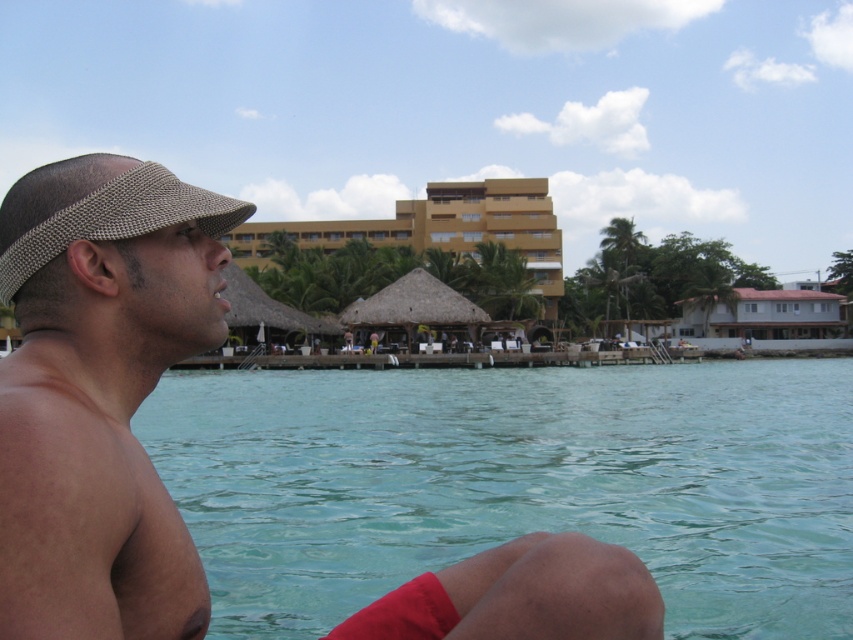
Question: Observing the image, what is the correct spatial positioning of matte brown visor at left in reference to yellow matte building at center?

Choices:
 (A) left
 (B) right

Answer: (B)

Question: Is red fabric at lower right closer to camera compared to yellow matte building at center?

Choices:
 (A) no
 (B) yes

Answer: (B)

Question: Can you confirm if matte brown visor at left is thinner than woven fabric visor at left?

Choices:
 (A) yes
 (B) no

Answer: (B)

Question: Estimate the real-world distances between objects in this image. Which object is farther from the woven fabric visor at left?

Choices:
 (A) knitted beige visor at left
 (B) red fabric at lower right

Answer: (B)

Question: Which point is closer to the camera taking this photo?

Choices:
 (A) (125, 256)
 (B) (502, 196)

Answer: (A)

Question: Which of the following is the farthest from the observer?

Choices:
 (A) (810, 339)
 (B) (190, 310)

Answer: (A)